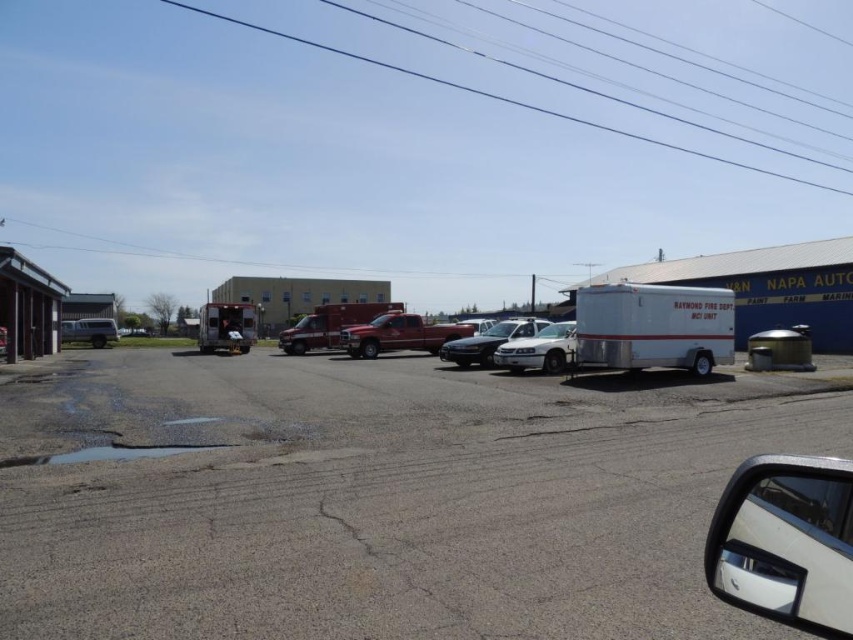
Which is above, satin silver sedan at center or white matte van at left?

white matte van at left

Between point (525, 324) and point (70, 321), which one is positioned behind?

The point (70, 321) is behind.

Who is more forward, (531, 320) or (88, 339)?

Point (531, 320)

Where is `satin silver sedan at center`? satin silver sedan at center is located at coordinates coord(488,340).

Is point (349, 308) more distant than point (512, 358)?

Yes, it is behind point (512, 358).

From the picture: Which is more to the left, shiny red fire truck at center or white glossy sedan at center?

From the viewer's perspective, shiny red fire truck at center appears more on the left side.

Describe the element at coordinates (329, 324) in the screenshot. I see `shiny red fire truck at center` at that location.

The image size is (853, 640). What are the coordinates of `shiny red fire truck at center` in the screenshot? It's located at click(x=329, y=324).

Between gray asphalt parking lot at center and metallic red fire truck at center, which one appears on the right side from the viewer's perspective?

Positioned to the right is metallic red fire truck at center.

Is gray asphalt parking lot at center positioned at the back of metallic red fire truck at center?

No, gray asphalt parking lot at center is closer to the viewer.

Which is behind, point (308, 476) or point (439, 337)?

Positioned behind is point (439, 337).

I want to click on gray asphalt parking lot at center, so click(x=375, y=497).